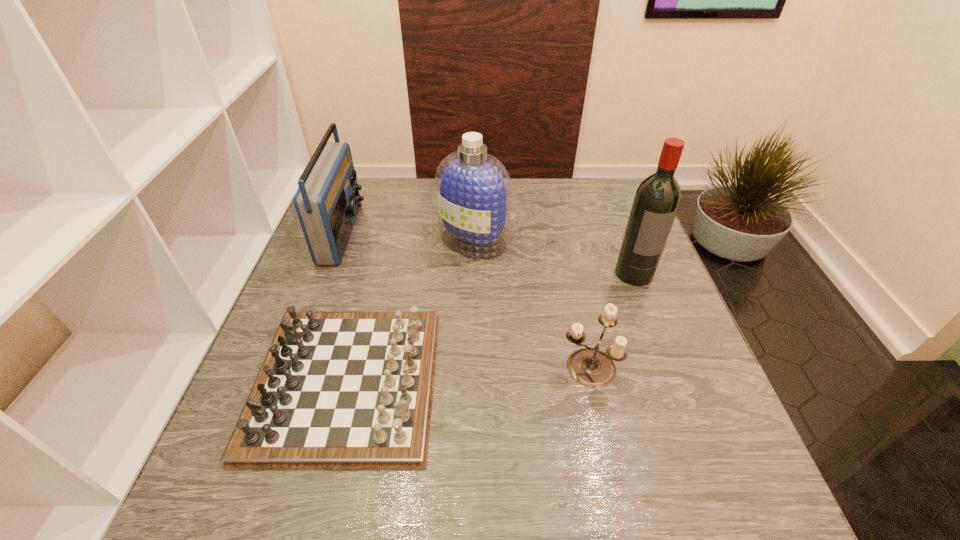
This screenshot has height=540, width=960. What are the coordinates of `vacant space located from the player's perspective of the shortest object` in the screenshot? It's located at (596, 382).

The image size is (960, 540). What are the coordinates of `cleansing agent positioned at the far edge` in the screenshot? It's located at (473, 188).

Find the location of a particular element. radio receiver located at the far edge is located at coordinates (327, 203).

Where is `object that is at the near edge`? object that is at the near edge is located at coordinates (337, 390).

At what (x,y) coordinates should I click in order to perform the action: click on radio receiver present at the left edge. Please return your answer as a coordinate pair (x, y). This screenshot has width=960, height=540. Looking at the image, I should click on (327, 203).

This screenshot has height=540, width=960. I want to click on chessboard that is at the left edge, so click(x=337, y=390).

I want to click on object that is positioned at the right edge, so click(657, 198).

You are a GUI agent. You are given a task and a screenshot of the screen. Output one action in this format:
    pyautogui.click(x=<x>, y=<y>)
    Task: Click on the object at the far left corner
    
    Given the screenshot: What is the action you would take?
    pyautogui.click(x=327, y=203)

Where is `object that is at the near left corner`? object that is at the near left corner is located at coordinates (337, 390).

Locate an element on the screen. The width and height of the screenshot is (960, 540). vacant space at the far edge of the desktop is located at coordinates (537, 204).